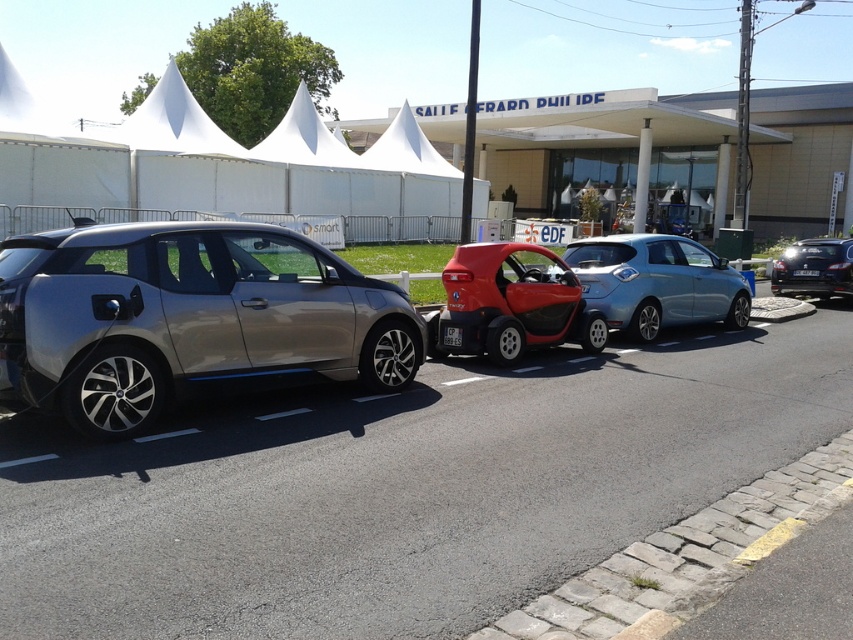
Question: Which point is closer to the camera taking this photo?

Choices:
 (A) (585, 304)
 (B) (834, 266)
 (C) (517, 458)

Answer: (C)

Question: Is satin silver car at center above shiny red car at center?

Choices:
 (A) no
 (B) yes

Answer: (A)

Question: Is metallic gray car at left thinner than shiny red car at center?

Choices:
 (A) no
 (B) yes

Answer: (A)

Question: Which point appears farthest from the camera in this image?

Choices:
 (A) (846, 250)
 (B) (456, 248)

Answer: (B)

Question: Is metallic gray car at left below metallic blue hatchback at center?

Choices:
 (A) no
 (B) yes

Answer: (B)

Question: Which is farther from the shiny red car at center?

Choices:
 (A) metallic gray car at left
 (B) metallic blue sedan at right
 (C) satin silver car at center

Answer: (B)